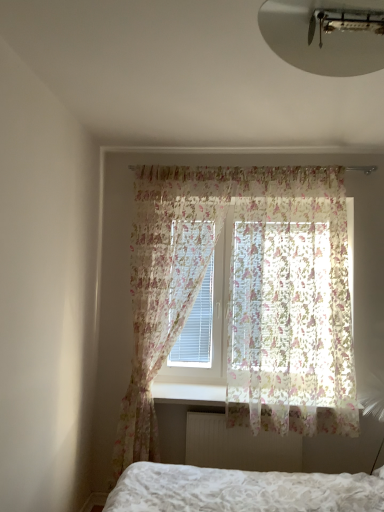
Question: Is translucent floral fabric at center, the 2th curtain in the right-to-left sequence, oriented towards translucent floral fabric at upper center, which is counted as the 2th curtain, starting from the left?

Choices:
 (A) yes
 (B) no

Answer: (B)

Question: Would you say translucent floral fabric at center, positioned as the first curtain in left-to-right order, is outside translucent floral fabric at upper center, the 1th curtain from the right?

Choices:
 (A) no
 (B) yes

Answer: (B)

Question: Is translucent floral fabric at upper center, the 1th curtain from the right, inside translucent floral fabric at center, the 2th curtain in the right-to-left sequence?

Choices:
 (A) yes
 (B) no

Answer: (B)

Question: Considering the relative sizes of translucent floral fabric at center, positioned as the first curtain in left-to-right order, and translucent floral fabric at upper center, which is counted as the 2th curtain, starting from the left, in the image provided, is translucent floral fabric at center, positioned as the first curtain in left-to-right order, wider than translucent floral fabric at upper center, which is counted as the 2th curtain, starting from the left,?

Choices:
 (A) yes
 (B) no

Answer: (B)

Question: Considering the relative sizes of translucent floral fabric at center, positioned as the first curtain in left-to-right order, and translucent floral fabric at upper center, the 1th curtain from the right, in the image provided, is translucent floral fabric at center, positioned as the first curtain in left-to-right order, taller than translucent floral fabric at upper center, the 1th curtain from the right,?

Choices:
 (A) yes
 (B) no

Answer: (A)

Question: Is translucent floral fabric at center, positioned as the first curtain in left-to-right order, thinner than translucent floral fabric at upper center, the 1th curtain from the right?

Choices:
 (A) no
 (B) yes

Answer: (B)

Question: Is white textured radiator at lower center oriented towards white plastic radiator at lower center?

Choices:
 (A) yes
 (B) no

Answer: (B)

Question: Is white textured radiator at lower center not close to white plastic radiator at lower center?

Choices:
 (A) no
 (B) yes

Answer: (A)

Question: Considering the relative sizes of white textured radiator at lower center and white plastic radiator at lower center in the image provided, is white textured radiator at lower center wider than white plastic radiator at lower center?

Choices:
 (A) yes
 (B) no

Answer: (B)

Question: From the image's perspective, is white textured radiator at lower center over white plastic radiator at lower center?

Choices:
 (A) yes
 (B) no

Answer: (B)

Question: Considering the relative sizes of white textured radiator at lower center and white plastic radiator at lower center in the image provided, is white textured radiator at lower center smaller than white plastic radiator at lower center?

Choices:
 (A) yes
 (B) no

Answer: (A)

Question: Is white textured radiator at lower center turned away from white plastic radiator at lower center?

Choices:
 (A) no
 (B) yes

Answer: (A)

Question: From the image's perspective, is translucent floral fabric at center, positioned as the first curtain in left-to-right order, located beneath white matte ceiling light at upper center?

Choices:
 (A) no
 (B) yes

Answer: (B)